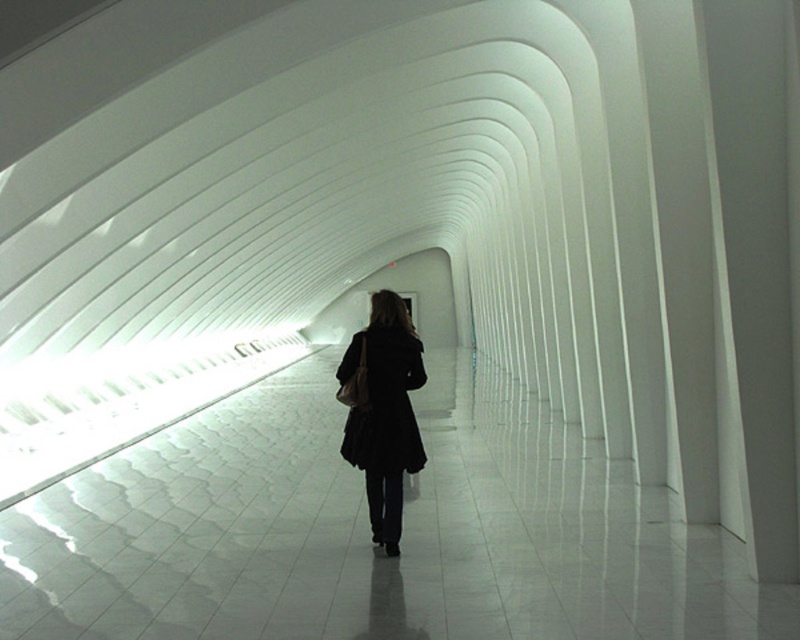
Is white glossy floor at center thinner than black matte coat at center?

In fact, white glossy floor at center might be wider than black matte coat at center.

Is white glossy floor at center to the left of black matte coat at center from the viewer's perspective?

Incorrect, white glossy floor at center is not on the left side of black matte coat at center.

Between point (150, 611) and point (410, 342), which one is positioned in front?

Positioned in front is point (150, 611).

At what (x,y) coordinates should I click in order to perform the action: click on white glossy floor at center. Please return your answer as a coordinate pair (x, y). The image size is (800, 640). Looking at the image, I should click on (370, 532).